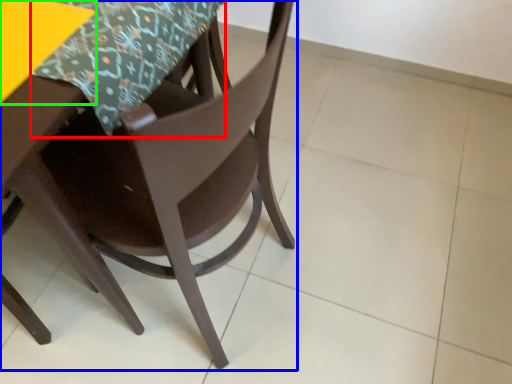
Question: Estimate the real-world distances between objects in this image. Which object is farther from tablecloth (highlighted by a red box), chair (highlighted by a blue box) or table (highlighted by a green box)?

Choices:
 (A) chair
 (B) table

Answer: (A)